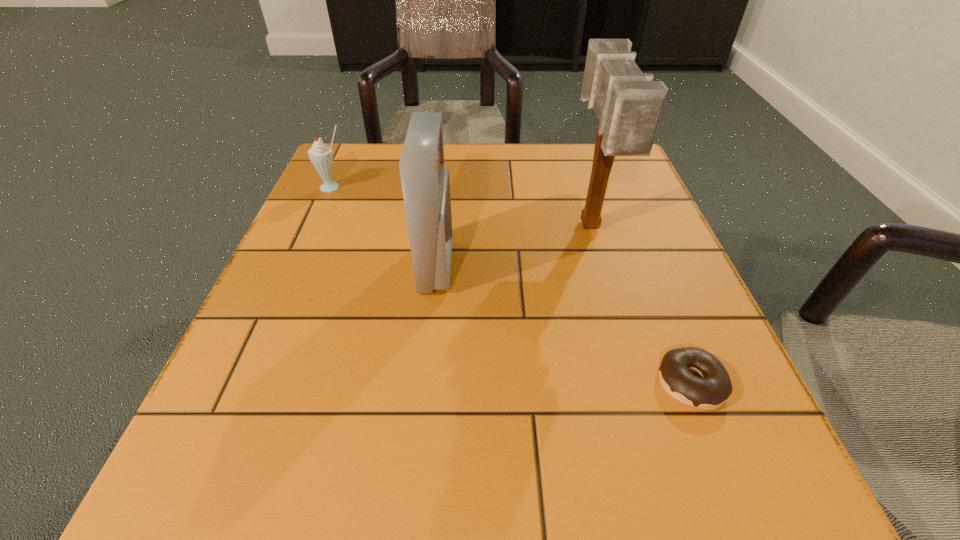
Find the location of a particular element. This screenshot has height=540, width=960. free space located on the left of the nearest object is located at coordinates (540, 383).

What are the coordinates of `mallet that is positioned at the far edge` in the screenshot? It's located at (628, 104).

The width and height of the screenshot is (960, 540). Find the location of `milkshake that is at the far edge`. milkshake that is at the far edge is located at coordinates (321, 155).

You are a GUI agent. You are given a task and a screenshot of the screen. Output one action in this format:
    pyautogui.click(x=<x>, y=<y>)
    Task: Click on the object situated at the left edge
    Image resolution: width=960 pixels, height=540 pixels.
    Given the screenshot: What is the action you would take?
    pyautogui.click(x=321, y=155)

Locate an element on the screen. This screenshot has width=960, height=540. mallet situated at the right edge is located at coordinates (628, 104).

Find the location of a particular element. The width and height of the screenshot is (960, 540). doughnut that is at the right edge is located at coordinates (714, 388).

Locate an element on the screen. Image resolution: width=960 pixels, height=540 pixels. object located at the far left corner is located at coordinates (321, 155).

Where is `object at the far right corner`? This screenshot has width=960, height=540. object at the far right corner is located at coordinates (628, 104).

At what (x,y) coordinates should I click in order to perform the action: click on vacant area at the far edge. Please return your answer as a coordinate pair (x, y). This screenshot has width=960, height=540. Looking at the image, I should click on pos(458,198).

In the image, there is a desktop. Where is `vacant space at the near edge`? vacant space at the near edge is located at coordinates (410, 493).